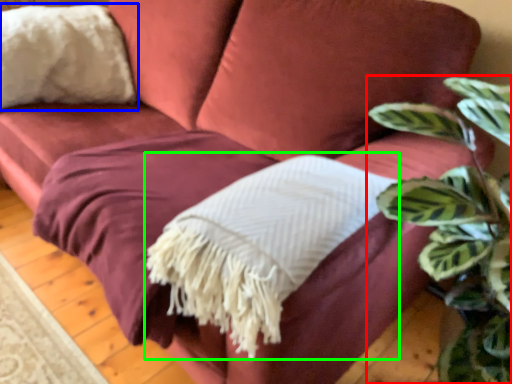
Question: Which is farther away from houseplant (highlighted by a red box)? throw pillow (highlighted by a blue box) or blanket (highlighted by a green box)?

Choices:
 (A) throw pillow
 (B) blanket

Answer: (A)